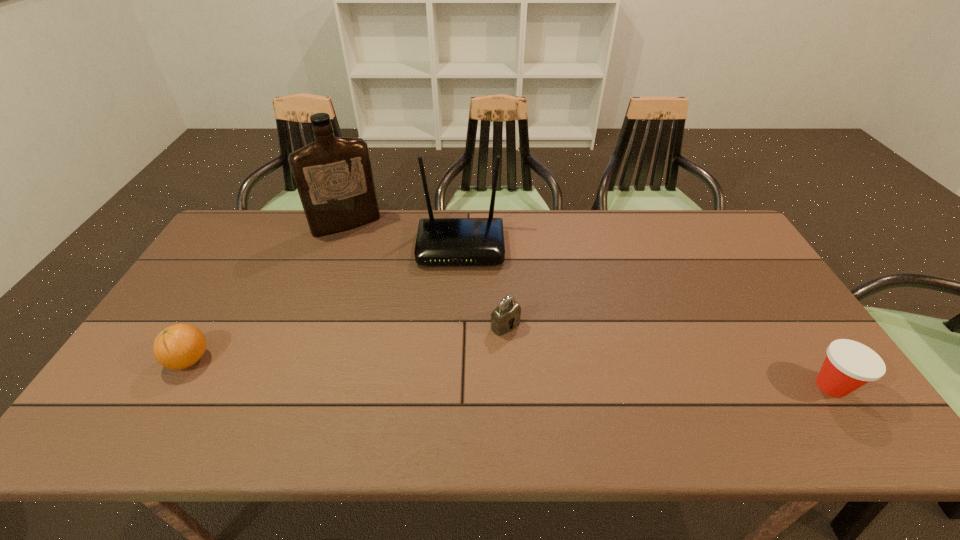
Identify which object is the closest to the rightmost object. Please provide its 2D coordinates. Your answer should be formatted as a tuple, i.e. [(x, y)], where the tuple contains the x and y coordinates of a point satisfying the conditions above.

[(502, 317)]

Find the location of a particular element. The image size is (960, 540). vacant space that satisfies the following two spatial constraints: 1. on the back side of the leftmost object; 2. on the right side of the router is located at coordinates (255, 246).

This screenshot has width=960, height=540. Identify the location of free location that satisfies the following two spatial constraints: 1. on the front side of the second tallest object; 2. on the left side of the Dixie cup. (454, 386).

Find the location of a particular element. free point that satisfies the following two spatial constraints: 1. on the front side of the rightmost object; 2. on the left side of the leftmost object is located at coordinates [x=174, y=386].

This screenshot has height=540, width=960. I want to click on free space that satisfies the following two spatial constraints: 1. on the front side of the padlock; 2. on the left side of the tallest object, so click(309, 326).

You are a GUI agent. You are given a task and a screenshot of the screen. Output one action in this format:
    pyautogui.click(x=<x>, y=<y>)
    Task: Click on the free space that satisfies the following two spatial constraints: 1. on the front side of the second tallest object; 2. on the left side of the third nearest object
    
    Given the screenshot: What is the action you would take?
    pyautogui.click(x=457, y=326)

I want to click on blank space that satisfies the following two spatial constraints: 1. on the back side of the leftmost object; 2. on the left side of the liquor, so click(269, 225).